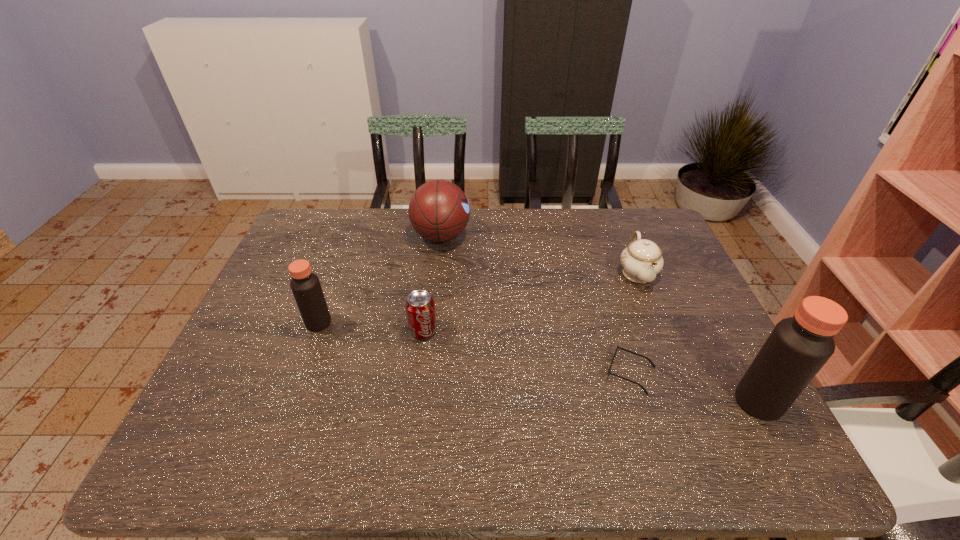
Locate an element on the screen. vinegar that is at the right edge is located at coordinates (798, 347).

At what (x,y) coordinates should I click in order to perform the action: click on chinaware present at the right edge. Please return your answer as a coordinate pair (x, y). This screenshot has width=960, height=540. Looking at the image, I should click on point(641,261).

Find the location of a particular element. Image resolution: width=960 pixels, height=540 pixels. object that is at the near right corner is located at coordinates (798, 347).

The height and width of the screenshot is (540, 960). In order to click on free spot at the far edge of the desktop in this screenshot , I will do `click(530, 240)`.

Identify the location of free space at the near edge. This screenshot has width=960, height=540. (366, 394).

Find the location of `free space at the left edge`. free space at the left edge is located at coordinates (273, 325).

In the image, there is a desktop. Where is `vacant space at the right edge`? The width and height of the screenshot is (960, 540). vacant space at the right edge is located at coordinates (676, 364).

At what (x,y) coordinates should I click in order to perform the action: click on free space at the far left corner of the desktop. Please return your answer as a coordinate pair (x, y). Image resolution: width=960 pixels, height=540 pixels. Looking at the image, I should click on (x=291, y=247).

Find the location of a particular element. vacant region at the far right corner of the desktop is located at coordinates (625, 245).

At what (x,y) coordinates should I click in order to perform the action: click on vacant space in between the soda can and the basketball. Please return your answer as a coordinate pair (x, y). The image size is (960, 540). Looking at the image, I should click on (432, 283).